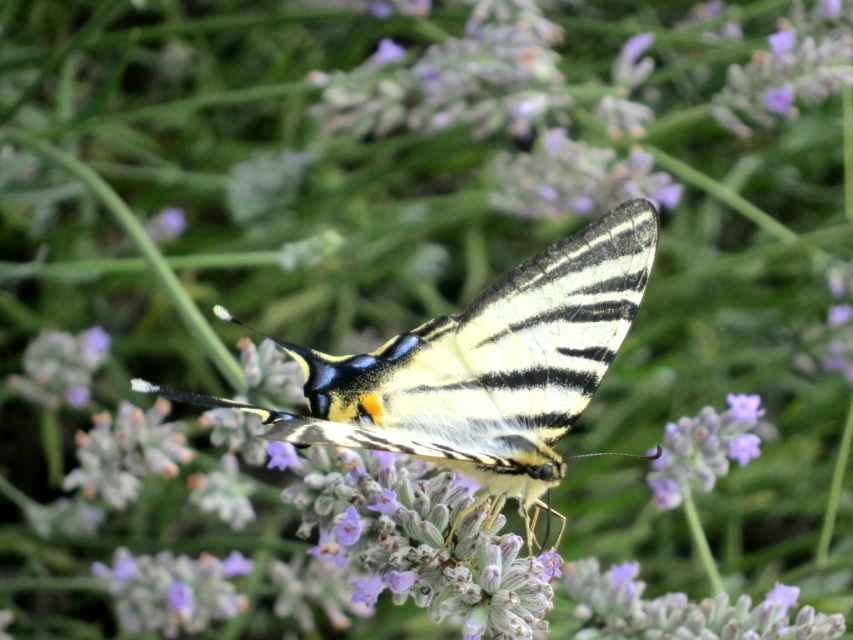
Where is `shiny yellow and black butterfly at center`? shiny yellow and black butterfly at center is located at coordinates (485, 369).

Is point (471, 381) behind point (753, 452)?

That is False.

Locate an element on the screen. This screenshot has height=640, width=853. shiny yellow and black butterfly at center is located at coordinates (485, 369).